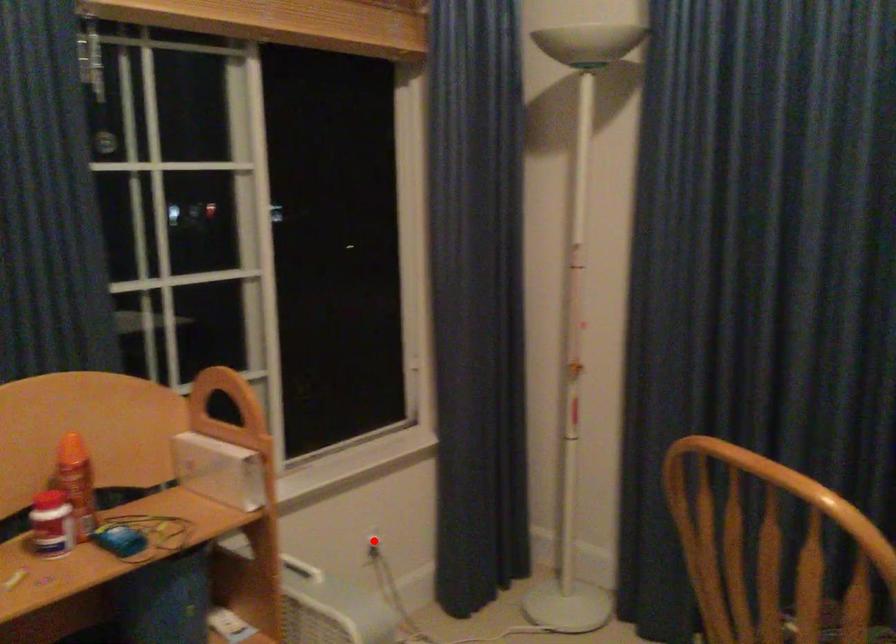
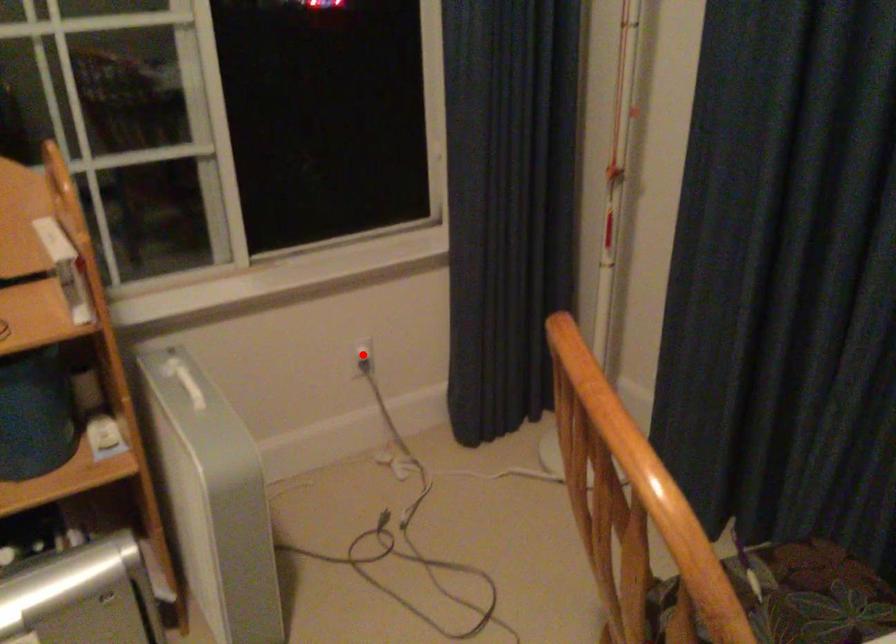
I am providing you with two images of the same scene from different viewpoints. A red point is marked on the first image and another point is marked on the second image. Is the marked point in image1 the same physical position as the marked point in image2?

Yes